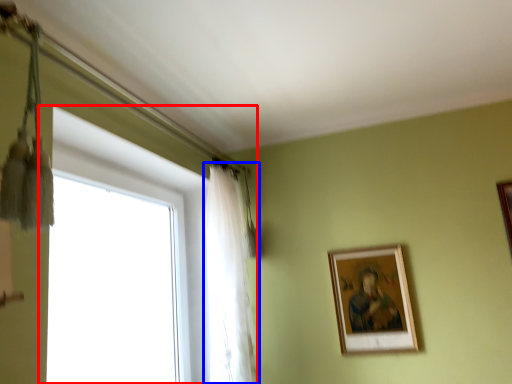
Question: Which of the following is the farthest to the observer, window (highlighted by a red box) or curtain (highlighted by a blue box)?

Choices:
 (A) window
 (B) curtain

Answer: (B)